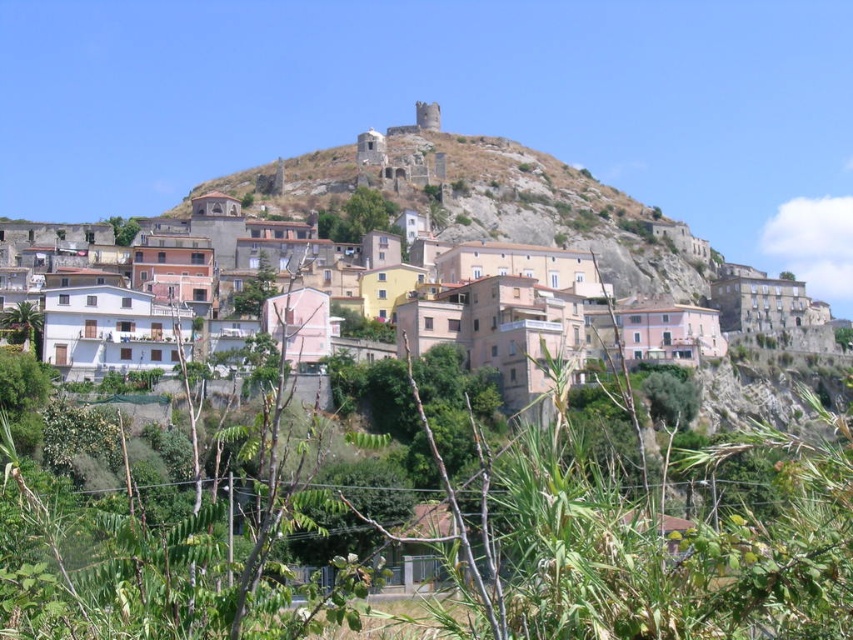
Consider the image. You are standing in the hillside town and want to take a photo of the pastel painted houses at center with the green leafy plants at center in the background. Can you position yourself so that the plants are to the left of the houses in the frame?

Yes, since the green leafy plants at center are already positioned to the left of the pastel painted houses at center, you can stand in a spot where the plants are on the left side of the frame while the houses are centered, achieving the desired composition.

From the picture: You are an architect designing a new pathway that needs to pass between the green leafy plants at center and the rustic stone castle at upper center. Based on their widths, which object should the pathway be closer to?

The pathway should be closer to the green leafy plants at center because it is thinner than the rustic stone castle at upper center.